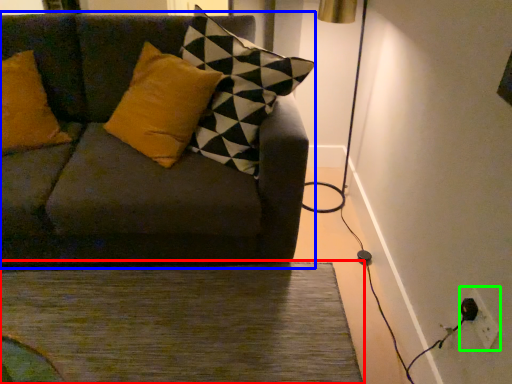
Question: Estimate the real-world distances between objects in this image. Which object is farther from doormat (highlighted by a red box), studio couch (highlighted by a blue box) or electric outlet (highlighted by a green box)?

Choices:
 (A) studio couch
 (B) electric outlet

Answer: (B)